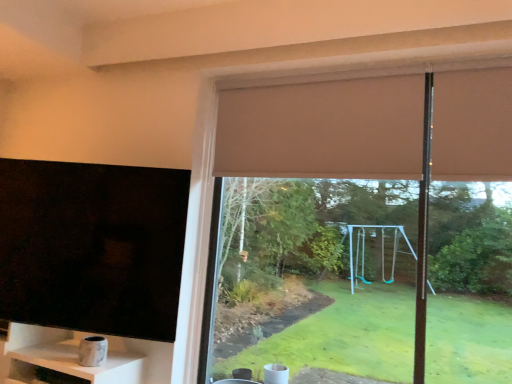
Question: Is matte brown roller blind at upper center taller than black matte tv at left?

Choices:
 (A) no
 (B) yes

Answer: (B)

Question: Considering the relative positions of matte brown roller blind at upper center and black matte tv at left in the image provided, is matte brown roller blind at upper center in front of black matte tv at left?

Choices:
 (A) yes
 (B) no

Answer: (A)

Question: From a real-world perspective, does matte brown roller blind at upper center stand above black matte tv at left?

Choices:
 (A) yes
 (B) no

Answer: (A)

Question: Is matte brown roller blind at upper center thinner than black matte tv at left?

Choices:
 (A) no
 (B) yes

Answer: (B)

Question: Does matte brown roller blind at upper center have a smaller size compared to black matte tv at left?

Choices:
 (A) yes
 (B) no

Answer: (B)

Question: Is matte brown roller blind at upper center wider than black matte tv at left?

Choices:
 (A) no
 (B) yes

Answer: (A)

Question: Does black matte tv at left contain marble-like white shelf at lower left?

Choices:
 (A) yes
 (B) no

Answer: (B)

Question: Is black matte tv at left positioned beyond the bounds of marble-like white shelf at lower left?

Choices:
 (A) yes
 (B) no

Answer: (A)

Question: Is black matte tv at left to the right of marble-like white shelf at lower left from the viewer's perspective?

Choices:
 (A) no
 (B) yes

Answer: (B)

Question: Is black matte tv at left with marble-like white shelf at lower left?

Choices:
 (A) no
 (B) yes

Answer: (A)

Question: Is black matte tv at left not near marble-like white shelf at lower left?

Choices:
 (A) no
 (B) yes

Answer: (A)

Question: Can you confirm if black matte tv at left is smaller than marble-like white shelf at lower left?

Choices:
 (A) yes
 (B) no

Answer: (B)

Question: Would you say beige fabric curtain at upper center is a long distance from black matte tv at left?

Choices:
 (A) no
 (B) yes

Answer: (A)